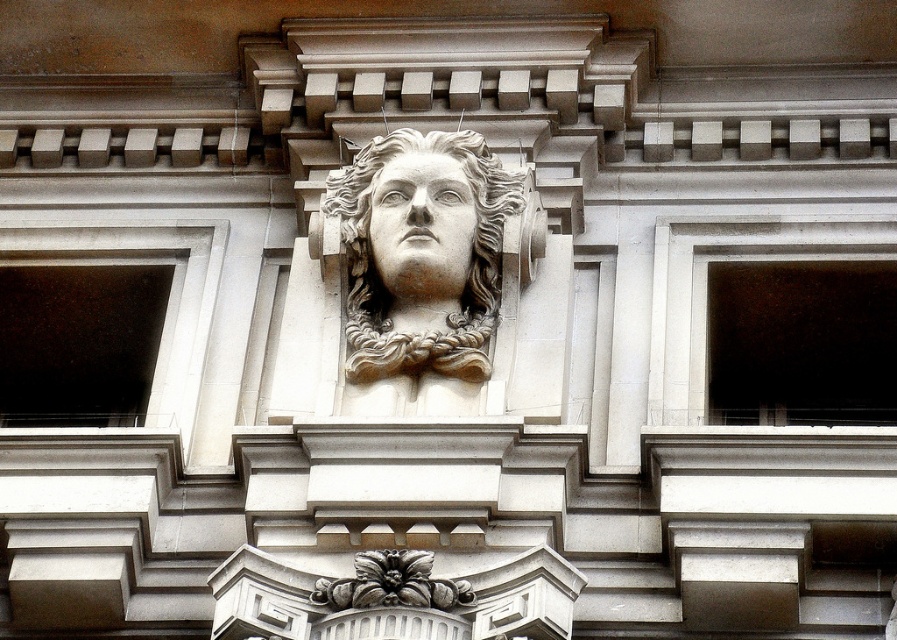
Question: Is transparent glass window at left further to camera compared to dark glass window at right?

Choices:
 (A) no
 (B) yes

Answer: (B)

Question: Is transparent glass window at left above white marble face at center?

Choices:
 (A) no
 (B) yes

Answer: (A)

Question: Which point is farther to the camera?

Choices:
 (A) transparent glass window at left
 (B) dark glass window at right

Answer: (A)

Question: From the image, what is the correct spatial relationship of stone sculpture at center in relation to transparent glass window at left?

Choices:
 (A) below
 (B) above

Answer: (B)

Question: Which object is closer to the camera taking this photo?

Choices:
 (A) stone sculpture at center
 (B) dark glass window at right
 (C) white marble face at center

Answer: (B)

Question: Among these points, which one is nearest to the camera?

Choices:
 (A) (405, 198)
 (B) (453, 266)
 (C) (138, 369)

Answer: (B)